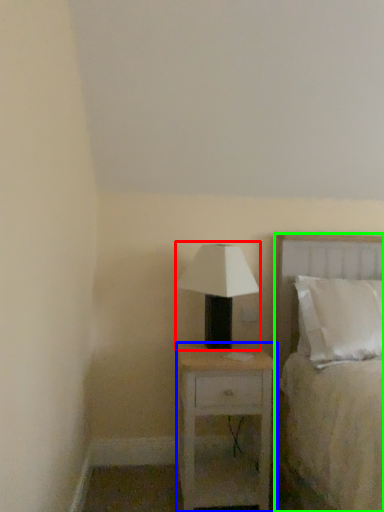
Question: Which is farther away from table lamp (highlighted by a red box)? nightstand (highlighted by a blue box) or bed (highlighted by a green box)?

Choices:
 (A) nightstand
 (B) bed

Answer: (B)